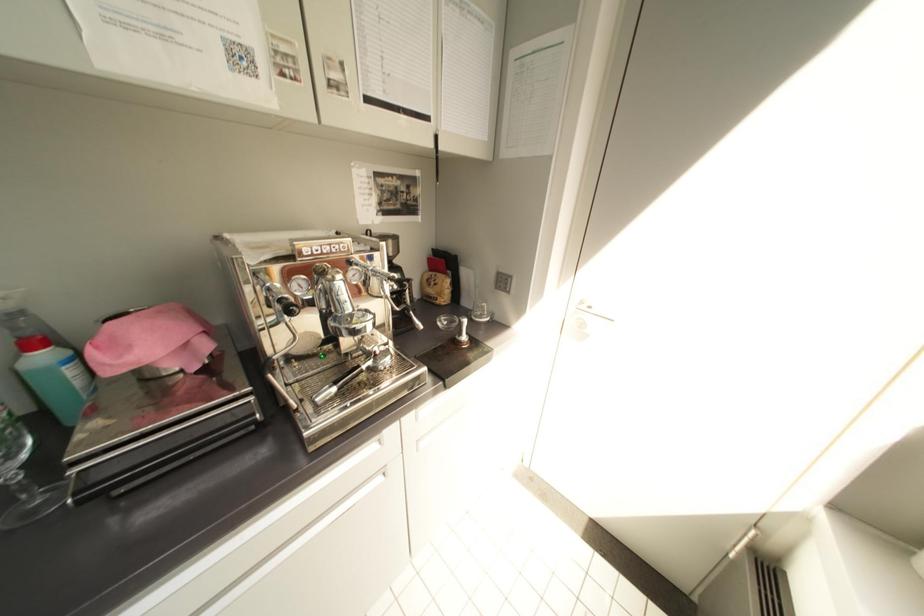
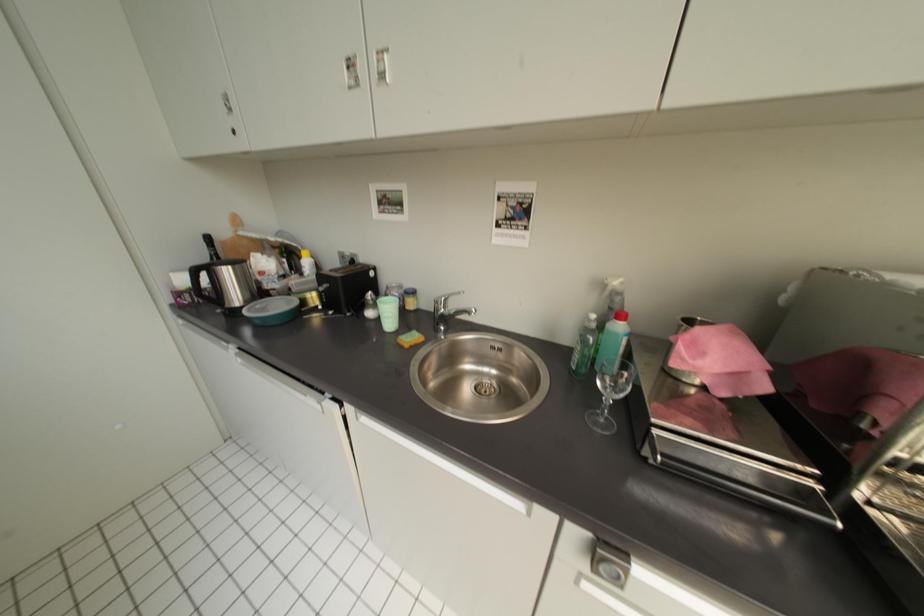
Question: The camera is either moving clockwise (left) or counter-clockwise (right) around the object. The first image is from the beginning of the video and the second image is from the end. Is the camera moving left or right when shooting the video?

Choices:
 (A) Left
 (B) Right

Answer: (B)